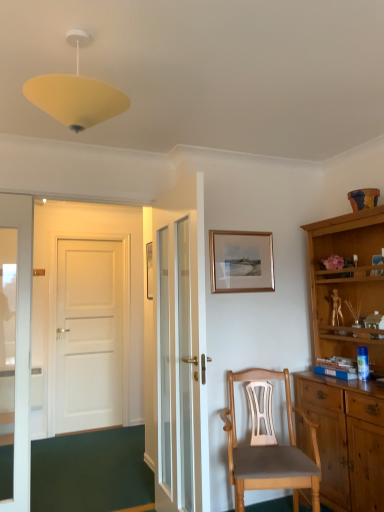
Describe the element at coordinates (241, 261) in the screenshot. This screenshot has height=512, width=384. I see `gold metallic picture frame at upper center` at that location.

Describe the element at coordinates (180, 351) in the screenshot. I see `white glass door at center` at that location.

The image size is (384, 512). What do you see at coordinates (270, 451) in the screenshot?
I see `light brown wooden chair at center` at bounding box center [270, 451].

Locate an element on the screen. gold metallic picture frame at upper center is located at coordinates (241, 261).

Is yellow matte/soft plastic lampshade at upper center positioned with its back to light brown wooden chair at center?

No, yellow matte/soft plastic lampshade at upper center is not facing the opposite direction of light brown wooden chair at center.

Measure the distance from yellow matte/soft plastic lampshade at upper center to light brown wooden chair at center.

yellow matte/soft plastic lampshade at upper center and light brown wooden chair at center are 6.60 feet apart from each other.

From a real-world perspective, who is located higher, yellow matte/soft plastic lampshade at upper center or light brown wooden chair at center?

yellow matte/soft plastic lampshade at upper center.

Considering the relative positions of yellow matte/soft plastic lampshade at upper center and light brown wooden chair at center in the image provided, is yellow matte/soft plastic lampshade at upper center to the left of light brown wooden chair at center from the viewer's perspective?

Indeed, yellow matte/soft plastic lampshade at upper center is positioned on the left side of light brown wooden chair at center.

Is white glass door at center facing away from yellow matte/soft plastic lampshade at upper center?

No.

From the image's perspective, who appears lower, white glass door at center or yellow matte/soft plastic lampshade at upper center?

From the image's view, white glass door at center is below.

Which of these two, white glass door at center or yellow matte/soft plastic lampshade at upper center, is smaller?

Smaller between the two is yellow matte/soft plastic lampshade at upper center.

Is white glass door at center far from yellow matte/soft plastic lampshade at upper center?

white glass door at center is far away from yellow matte/soft plastic lampshade at upper center.

Considering the positions of point (157, 368) and point (275, 469), is point (157, 368) closer or farther from the camera than point (275, 469)?

Point (157, 368) is farther from the camera than point (275, 469).

Which is in front, white glass door at center or light brown wooden chair at center?

white glass door at center is more forward.

Is white glass door at center looking in the opposite direction of light brown wooden chair at center?

Yes, white glass door at center is positioned with its back facing light brown wooden chair at center.

Can you confirm if white glass door at center is bigger than light brown wooden chair at center?

Actually, white glass door at center might be smaller than light brown wooden chair at center.

Is light brown wooden chair at center turned away from white glass door at center?

light brown wooden chair at center is not turned away from white glass door at center.

Can we say light brown wooden chair at center lies outside white glass door at center?

Indeed, light brown wooden chair at center is completely outside white glass door at center.

From a real-world perspective, which is physically below, light brown wooden chair at center or white glass door at center?

light brown wooden chair at center.

Can gold metallic picture frame at upper center be found inside yellow matte/soft plastic lampshade at upper center?

No, gold metallic picture frame at upper center is not surrounded by yellow matte/soft plastic lampshade at upper center.

Is yellow matte/soft plastic lampshade at upper center closer to camera compared to gold metallic picture frame at upper center?

Yes, it is.

From their relative heights in the image, would you say yellow matte/soft plastic lampshade at upper center is taller or shorter than gold metallic picture frame at upper center?

yellow matte/soft plastic lampshade at upper center is shorter than gold metallic picture frame at upper center.

From the picture: Does yellow matte/soft plastic lampshade at upper center turn towards gold metallic picture frame at upper center?

No, yellow matte/soft plastic lampshade at upper center is not oriented towards gold metallic picture frame at upper center.

Is light brown wooden chair at center to the left of gold metallic picture frame at upper center from the viewer's perspective?

No.

From the image's perspective, does light brown wooden chair at center appear higher than gold metallic picture frame at upper center?

No.

Is light brown wooden chair at center thinner than gold metallic picture frame at upper center?

Incorrect, the width of light brown wooden chair at center is not less than that of gold metallic picture frame at upper center.

Does gold metallic picture frame at upper center have a greater width compared to white glass door at center?

No, gold metallic picture frame at upper center is not wider than white glass door at center.

Is gold metallic picture frame at upper center next to white glass door at center and touching it?

gold metallic picture frame at upper center and white glass door at center are clearly separated.

Can you confirm if gold metallic picture frame at upper center is taller than white glass door at center?

No.

Is gold metallic picture frame at upper center positioned with its back to white glass door at center?

No, gold metallic picture frame at upper center is not facing the opposite direction of white glass door at center.

The image size is (384, 512). In order to click on chair that is under the yellow matte/soft plastic lampshade at upper center (from a real-world perspective) in this screenshot , I will do `click(270, 451)`.

The width and height of the screenshot is (384, 512). I want to click on door behind the yellow matte/soft plastic lampshade at upper center, so click(180, 351).

Looking at this image, when comparing their distances from light brown wooden chair at center, does white glass door at center or gold metallic picture frame at upper center seem closer?

The object closer to light brown wooden chair at center is white glass door at center.

Looking at the image, which one is located closer to gold metallic picture frame at upper center, yellow matte/soft plastic lampshade at upper center or light brown wooden chair at center?

Among the two, light brown wooden chair at center is located nearer to gold metallic picture frame at upper center.

Looking at this image, from the image, which object appears to be nearer to white glass door at center, gold metallic picture frame at upper center or yellow matte/soft plastic lampshade at upper center?

gold metallic picture frame at upper center is positioned closer to the anchor white glass door at center.

Which object lies nearer to the anchor point light brown wooden chair at center, gold metallic picture frame at upper center or yellow matte/soft plastic lampshade at upper center?

gold metallic picture frame at upper center is positioned closer to the anchor light brown wooden chair at center.

Based on their spatial positions, is light brown wooden chair at center or white glass door at center further from gold metallic picture frame at upper center?

light brown wooden chair at center is further to gold metallic picture frame at upper center.

Based on the photo, when comparing their distances from gold metallic picture frame at upper center, does white glass door at center or yellow matte/soft plastic lampshade at upper center seem closer?

white glass door at center is closer to gold metallic picture frame at upper center.

From the image, which object appears to be farther from white glass door at center, yellow matte/soft plastic lampshade at upper center or light brown wooden chair at center?

Among the two, yellow matte/soft plastic lampshade at upper center is located further to white glass door at center.

From the image, which object appears to be farther from light brown wooden chair at center, yellow matte/soft plastic lampshade at upper center or white glass door at center?

yellow matte/soft plastic lampshade at upper center lies further to light brown wooden chair at center than the other object.

Where is `door positioned between yellow matte/soft plastic lampshade at upper center and gold metallic picture frame at upper center from near to far`? The height and width of the screenshot is (512, 384). door positioned between yellow matte/soft plastic lampshade at upper center and gold metallic picture frame at upper center from near to far is located at coordinates (180, 351).

Where is `picture frame between yellow matte/soft plastic lampshade at upper center and light brown wooden chair at center in the up-down direction`? The height and width of the screenshot is (512, 384). picture frame between yellow matte/soft plastic lampshade at upper center and light brown wooden chair at center in the up-down direction is located at coordinates [x=241, y=261].

The height and width of the screenshot is (512, 384). What are the coordinates of `door between gold metallic picture frame at upper center and light brown wooden chair at center from top to bottom` in the screenshot? It's located at (180, 351).

At what (x,y) coordinates should I click in order to perform the action: click on door between yellow matte/soft plastic lampshade at upper center and light brown wooden chair at center in the up-down direction. Please return your answer as a coordinate pair (x, y). Looking at the image, I should click on (180, 351).